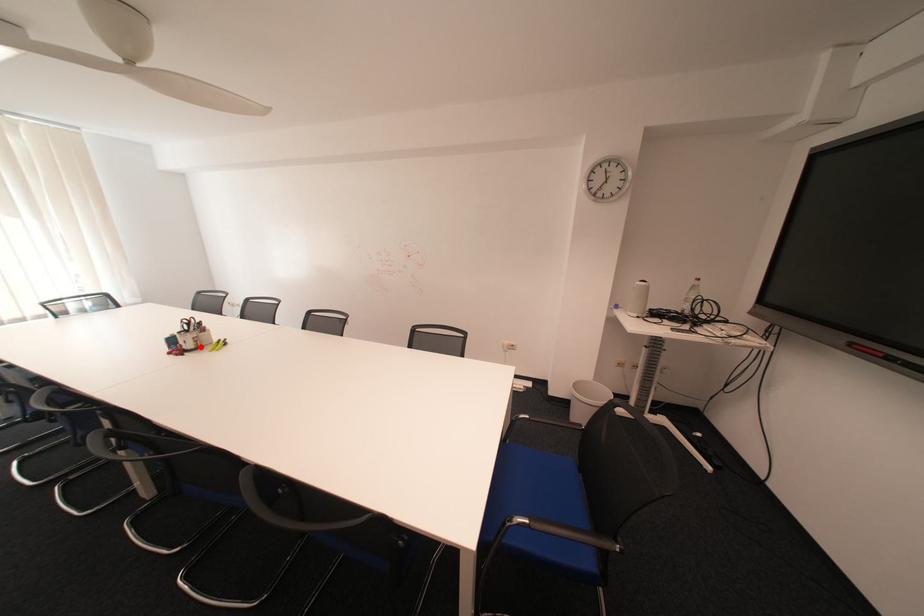
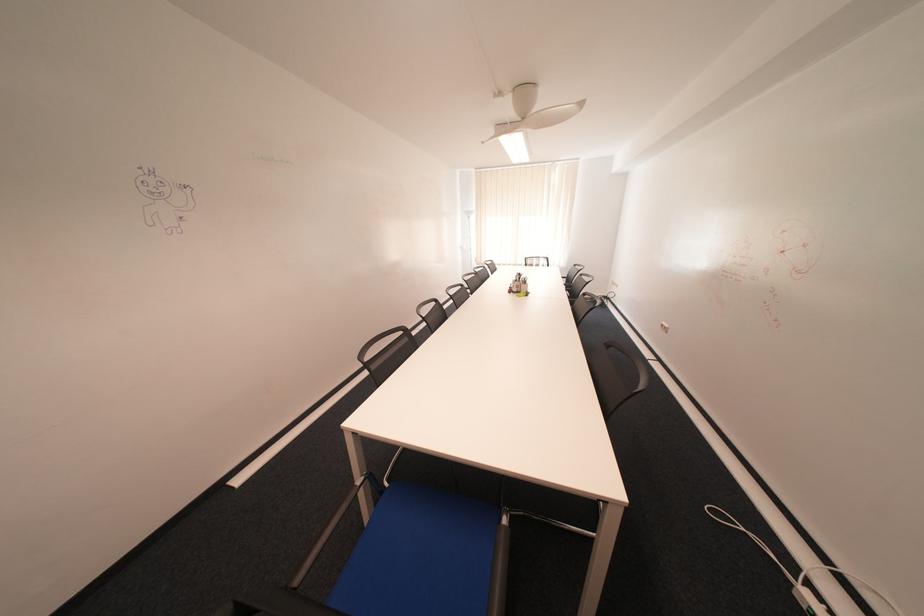
In the second image, find the point that corresponds to the highlighted location in the first image.

(526, 290)